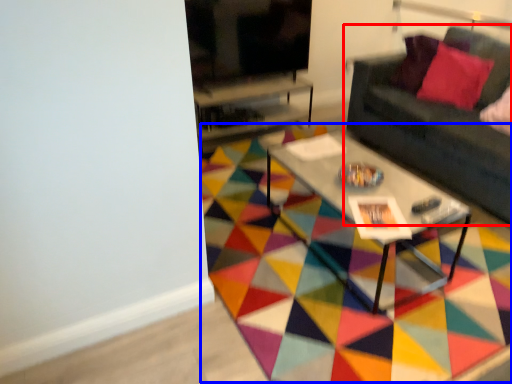
Question: Which of the following is the closest to the observer, studio couch (highlighted by a red box) or mat (highlighted by a blue box)?

Choices:
 (A) studio couch
 (B) mat

Answer: (B)